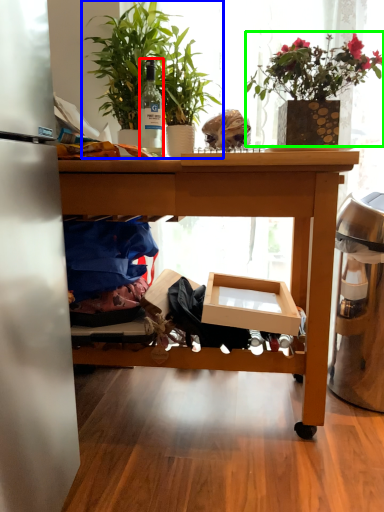
Question: Estimate the real-world distances between objects in this image. Which object is farther from bottle (highlighted by a red box), houseplant (highlighted by a blue box) or houseplant (highlighted by a green box)?

Choices:
 (A) houseplant
 (B) houseplant

Answer: (B)